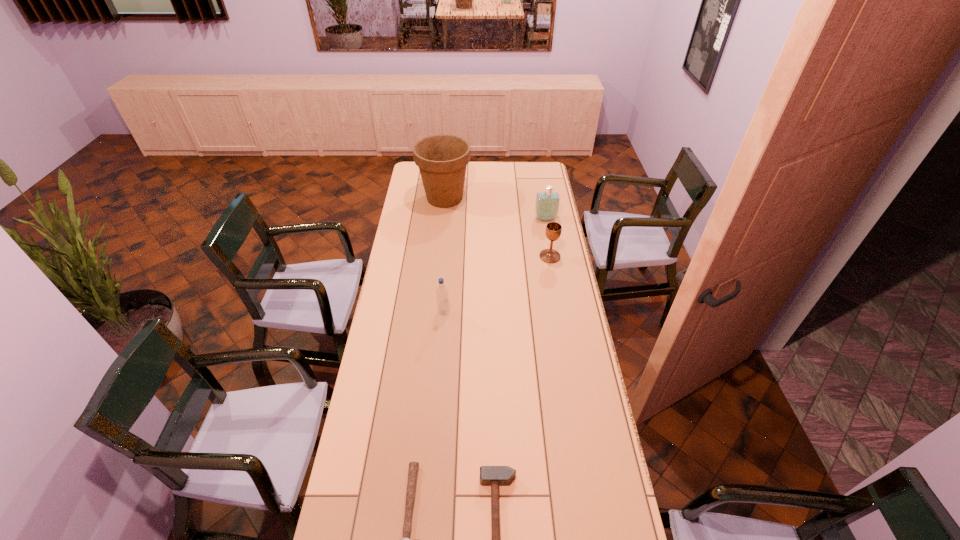
At what (x,y) coordinates should I click in order to perform the action: click on object that ranks as the closest to the flowerpot. Please return your answer as a coordinate pair (x, y). Image resolution: width=960 pixels, height=540 pixels. Looking at the image, I should click on (547, 203).